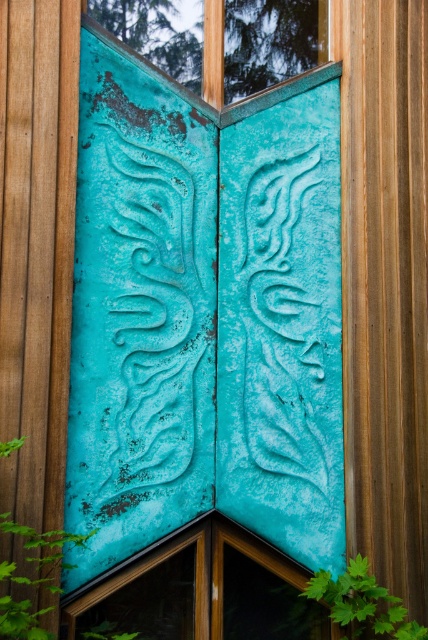
Question: Among these objects, which one is farthest from the camera?

Choices:
 (A) aqua patina door at center
 (B) teal patina glass at upper center

Answer: (B)

Question: Where is aqua patina door at center located in relation to teal patina glass at upper center in the image?

Choices:
 (A) below
 (B) above

Answer: (A)

Question: Among these points, which one is farthest from the camera?

Choices:
 (A) (223, 65)
 (B) (315, 637)

Answer: (A)

Question: Observing the image, what is the correct spatial positioning of aqua patina door at center in reference to teal patina glass at upper center?

Choices:
 (A) below
 (B) above

Answer: (A)

Question: Which object appears farthest from the camera in this image?

Choices:
 (A) aqua patina door at center
 (B) teal patina glass at upper center

Answer: (B)

Question: Observing the image, what is the correct spatial positioning of aqua patina door at center in reference to teal patina glass at upper center?

Choices:
 (A) below
 (B) above

Answer: (A)